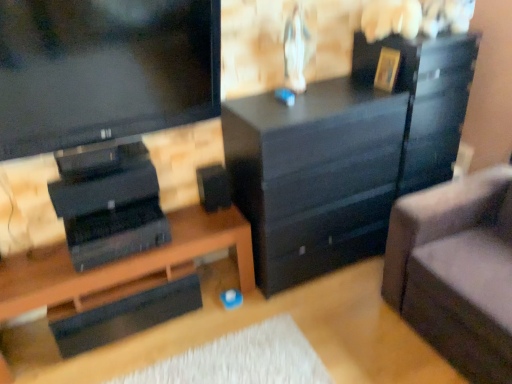
What do you see at coordinates (344, 156) in the screenshot? I see `black matte chest of drawers at center` at bounding box center [344, 156].

What do you see at coordinates (123, 262) in the screenshot? This screenshot has width=512, height=384. I see `black matte desk at lower left` at bounding box center [123, 262].

This screenshot has height=384, width=512. I want to click on black matte desk at lower left, so click(x=123, y=262).

Identify the location of black matte chest of drawers at center. Image resolution: width=512 pixels, height=384 pixels. (344, 156).

Can we say black matte chest of drawers at center lies outside black matte desk at lower left?

Yes, black matte chest of drawers at center is outside of black matte desk at lower left.

Is black matte desk at lower left at the back of black matte chest of drawers at center?

No.

Identify the location of desk to the left of black matte chest of drawers at center. This screenshot has height=384, width=512. (123, 262).

Is black matte chest of drawers at center to the left or to the right of black matte desk at lower left in the image?

black matte chest of drawers at center is to the right of black matte desk at lower left.

Considering the sizes of objects suede gray couch at right and black matte speaker at center in the image provided, who is thinner, suede gray couch at right or black matte speaker at center?

With smaller width is black matte speaker at center.

From the image's perspective, which one is positioned higher, suede gray couch at right or black matte speaker at center?

black matte speaker at center, from the image's perspective.

Is point (397, 246) positioned behind point (198, 176)?

No, (397, 246) is in front of (198, 176).

Would you say suede gray couch at right is inside or outside black matte speaker at center?

suede gray couch at right is outside black matte speaker at center.

Does gold metallic picture frame at upper right come in front of black matte desk at lower left?

No, it is not.

Find the location of a particular element. picture frame behind the black matte desk at lower left is located at coordinates (387, 69).

Measure the distance from gold metallic picture frame at upper right to black matte desk at lower left.

A distance of 1.37 meters exists between gold metallic picture frame at upper right and black matte desk at lower left.

From a real-world perspective, is gold metallic picture frame at upper right positioned above or below black matte desk at lower left?

gold metallic picture frame at upper right is above black matte desk at lower left.

Which of these two, glossy black file cabinet at right or gold metallic picture frame at upper right, stands taller?

With more height is glossy black file cabinet at right.

Is glossy black file cabinet at right to the right of gold metallic picture frame at upper right from the viewer's perspective?

Indeed, glossy black file cabinet at right is positioned on the right side of gold metallic picture frame at upper right.

Locate an element on the screen. This screenshot has width=512, height=384. picture frame behind the glossy black file cabinet at right is located at coordinates (387, 69).

Can you confirm if suede gray couch at right is thinner than black matte desk at lower left?

No.

Is suede gray couch at right spatially inside black matte desk at lower left, or outside of it?

The correct answer is: outside.

Based on the photo, from a real-world perspective, is suede gray couch at right physically below black matte desk at lower left?

No, from a real-world perspective, suede gray couch at right is not below black matte desk at lower left.

Between black matte desk at lower left and glossy black file cabinet at right, which one has smaller size?

black matte desk at lower left.

Which of these two, black matte desk at lower left or glossy black file cabinet at right, stands shorter?

black matte desk at lower left.

Looking at this image, can we say black matte desk at lower left lies outside glossy black file cabinet at right?

Indeed, black matte desk at lower left is completely outside glossy black file cabinet at right.

From the image's perspective, is black matte desk at lower left located beneath glossy black file cabinet at right?

Yes.

Consider the image. Is glossy black file cabinet at right wider or thinner than black matte desk at lower left?

glossy black file cabinet at right is wider than black matte desk at lower left.

Between glossy black file cabinet at right and black matte desk at lower left, which one appears on the left side from the viewer's perspective?

From the viewer's perspective, black matte desk at lower left appears more on the left side.

Does glossy black file cabinet at right have a lesser height compared to black matte desk at lower left?

No, glossy black file cabinet at right is not shorter than black matte desk at lower left.

Locate an element on the screen. The height and width of the screenshot is (384, 512). desk below the black matte chest of drawers at center (from a real-world perspective) is located at coordinates (123, 262).

This screenshot has height=384, width=512. I want to click on studio couch in front of the black matte speaker at center, so [x=457, y=271].

From the image, which object appears to be nearer to glossy black file cabinet at right, black matte chest of drawers at center or gold metallic picture frame at upper right?

black matte chest of drawers at center lies closer to glossy black file cabinet at right than the other object.

Looking at the image, which one is located further to gold metallic picture frame at upper right, black matte speaker at center or black matte chest of drawers at center?

Among the two, black matte speaker at center is located further to gold metallic picture frame at upper right.

Looking at the image, which one is located further to black matte desk at lower left, glossy black file cabinet at right or gold metallic picture frame at upper right?

Based on the image, gold metallic picture frame at upper right appears to be further to black matte desk at lower left.

From the image, which object appears to be nearer to gold metallic picture frame at upper right, black matte desk at lower left or black matte chest of drawers at center?

Among the two, black matte chest of drawers at center is located nearer to gold metallic picture frame at upper right.

Which object lies nearer to the anchor point suede gray couch at right, black matte speaker at center or black matte chest of drawers at center?

black matte chest of drawers at center.

Based on their spatial positions, is black matte speaker at center or glossy black file cabinet at right closer to suede gray couch at right?

glossy black file cabinet at right is positioned closer to the anchor suede gray couch at right.

From the image, which object appears to be farther from black matte speaker at center, glossy black file cabinet at right or gold metallic picture frame at upper right?

glossy black file cabinet at right.

Estimate the real-world distances between objects in this image. Which object is closer to suede gray couch at right, gold metallic picture frame at upper right or black matte desk at lower left?

The object closer to suede gray couch at right is gold metallic picture frame at upper right.

Where is `the chest of drawers located between black matte speaker at center and gold metallic picture frame at upper right in the left-right direction`? the chest of drawers located between black matte speaker at center and gold metallic picture frame at upper right in the left-right direction is located at coordinates (344, 156).

Identify the location of picture frame between black matte desk at lower left and suede gray couch at right from left to right. (387, 69).

The width and height of the screenshot is (512, 384). Find the location of `chest of drawers between gold metallic picture frame at upper right and suede gray couch at right from top to bottom`. chest of drawers between gold metallic picture frame at upper right and suede gray couch at right from top to bottom is located at coordinates (344, 156).

The image size is (512, 384). I want to click on picture frame situated between black matte desk at lower left and glossy black file cabinet at right from left to right, so click(387, 69).